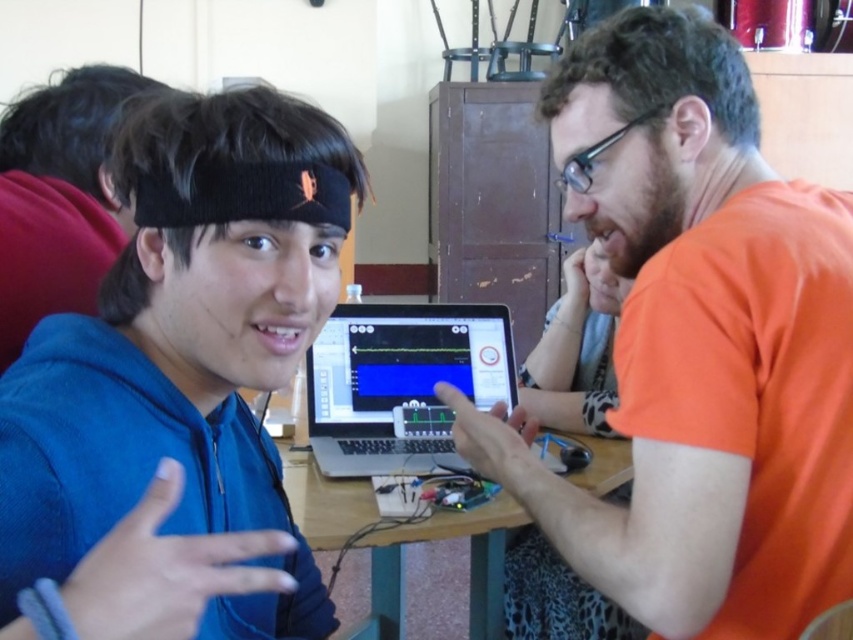
You are standing in the room and want to know the exact position of the orange matte shirt at right. Can you determine its coordinates based on the scene?

The orange matte shirt at right is located at point (x=699, y=344).

You are a photographer setting up for a group photo. You need to position the orange matte shirt at right and the blue fleece jacket at center so that they are both fully visible in the frame. Based on their current positions and sizes, which person should you move closer to the camera to ensure both are visible without cropping?

Since the orange matte shirt at right might be wider than the blue fleece jacket at center, you should move the orange matte shirt at right closer to the camera. This adjustment will help ensure both individuals are fully visible without cropping, as the wider person requires more space in the frame.

You are a technician trying to locate the blue knit cap at upper left and the satin silver laptop at center in the image. Based on their positions, which object is higher up in the image?

The blue knit cap at upper left is higher up in the image because the satin silver laptop at center is below it.